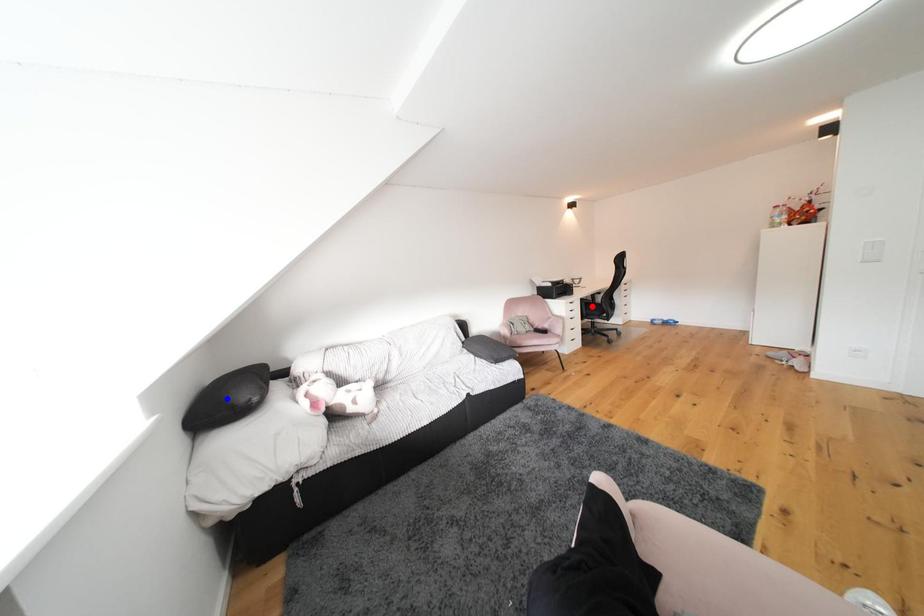
Question: In the image, two points are highlighted. Which point is nearer to the camera? Reply with the corresponding letter.

Choices:
 (A) blue point
 (B) red point

Answer: (A)